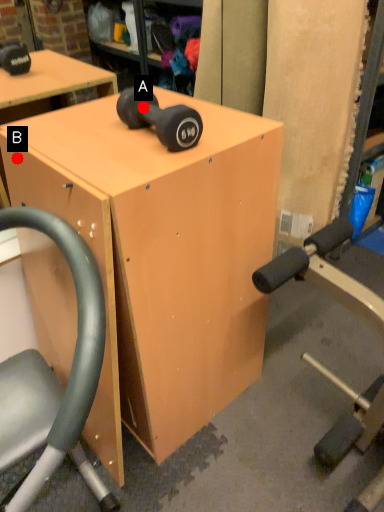
Question: Two points are circled on the image, labeled by A and B beside each circle. Which point appears closest to the camera in this image?

Choices:
 (A) A is closer
 (B) B is closer

Answer: (A)